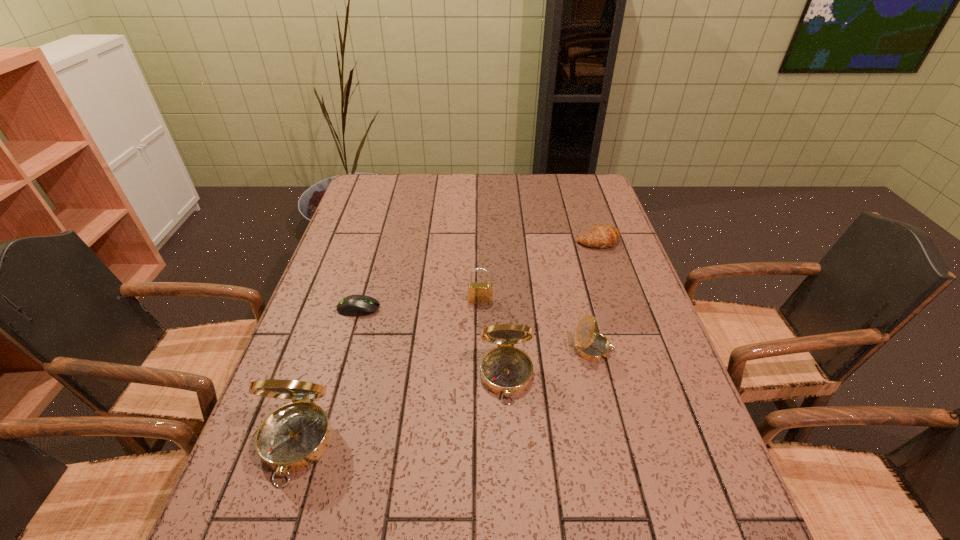
If equal spacing is the goal by inserting an additional compass among them, please point out a vacant space for this new compass. Please provide its 2D coordinates. Your answer should be formatted as a tuple, i.e. [(x, y)], where the tuple contains the x and y coordinates of a point satisfying the conditions above.

[(408, 408)]